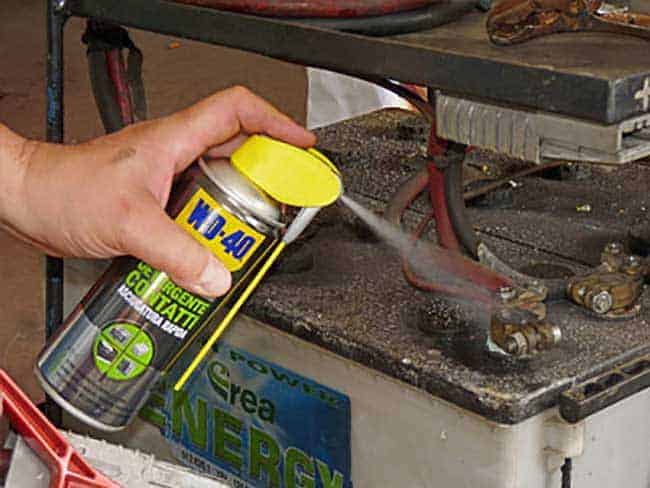
Where is `top of shelf`? top of shelf is located at coordinates (348, 49).